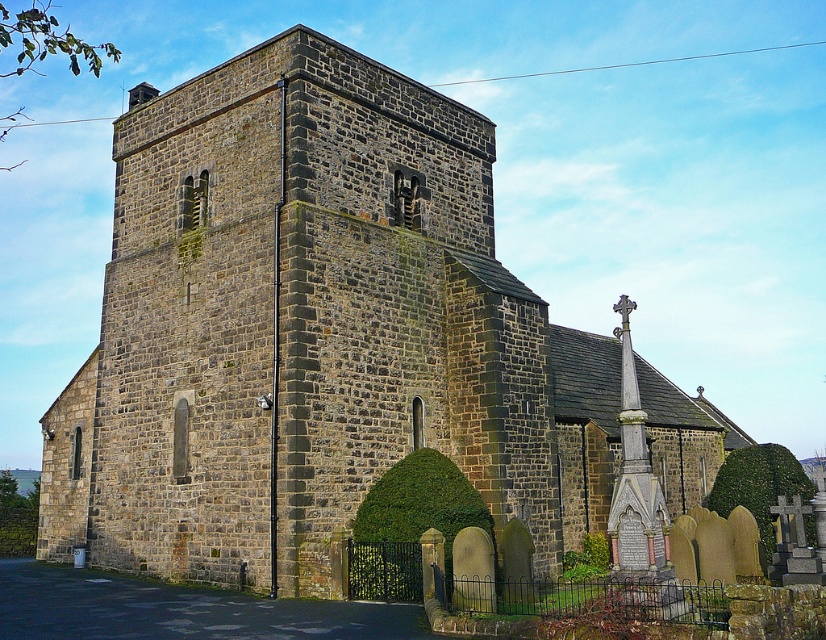
Which is in front, point (473, 506) or point (739, 449)?

Point (473, 506)

Is point (397, 589) closer to camera compared to point (774, 538)?

That is True.

You are a GUI agent. You are given a task and a screenshot of the screen. Output one action in this format:
    pyautogui.click(x=<x>, y=<y>)
    Task: Click on the green leafy hedge at lower center
    
    Given the screenshot: What is the action you would take?
    pyautogui.click(x=409, y=524)

Does green leafy hedge at lower center have a smaller size compared to green leafy hedge at lower left?

Yes, green leafy hedge at lower center is smaller than green leafy hedge at lower left.

This screenshot has width=826, height=640. Find the location of `green leafy hedge at lower center`. green leafy hedge at lower center is located at coordinates (409, 524).

Which is behind, point (387, 509) or point (34, 502)?

Point (34, 502)

Where is `green leafy hedge at lower center`? This screenshot has width=826, height=640. green leafy hedge at lower center is located at coordinates (409, 524).

Looking at this image, is green leafy hedge at lower right to the right of green leafy hedge at lower left from the viewer's perspective?

Yes, green leafy hedge at lower right is to the right of green leafy hedge at lower left.

Which is behind, point (717, 508) or point (8, 486)?

The point (8, 486) is behind.

Identify the location of green leafy hedge at lower right. This screenshot has width=826, height=640. 758,486.